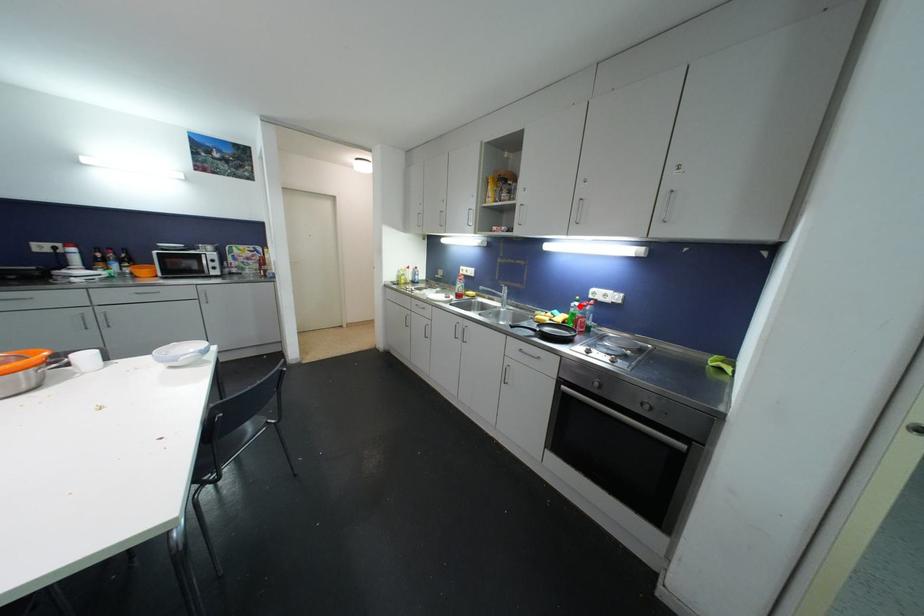
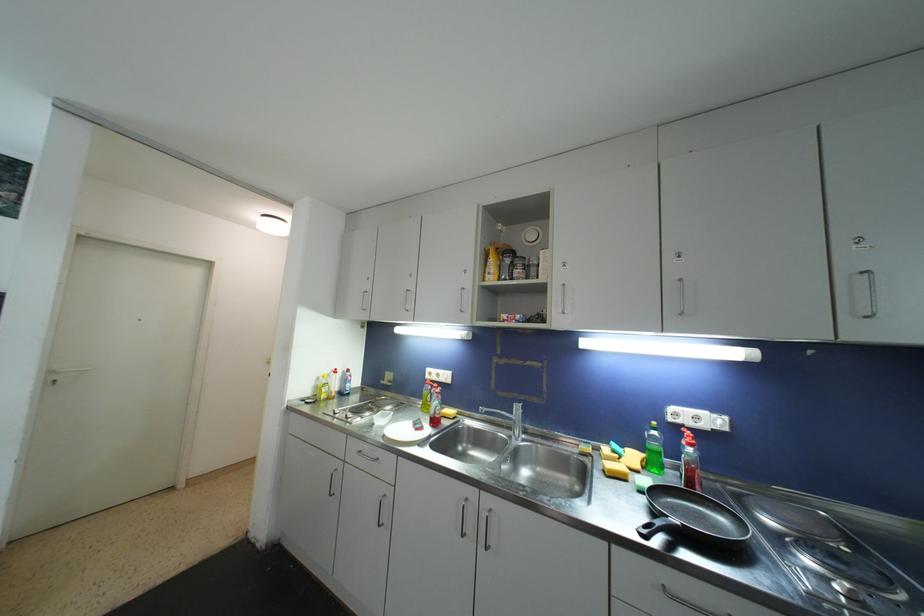
Question: I am providing you with two images of the same scene from different viewpoints. A red point is shown in image1. For the corresponding object point in image2, is it positioned nearer or farther from the camera?

Choices:
 (A) Nearer
 (B) Farther

Answer: (B)